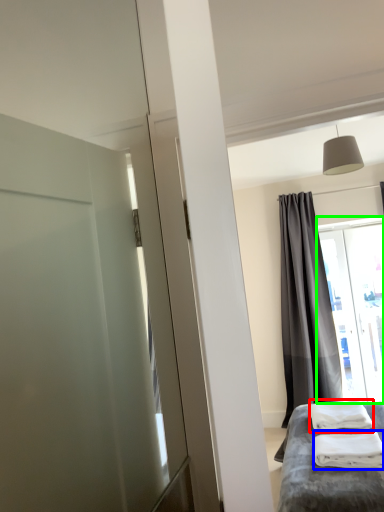
Question: Considering the real-world distances, which object is farthest from bath towel (highlighted by a red box)? material (highlighted by a blue box) or window (highlighted by a green box)?

Choices:
 (A) material
 (B) window

Answer: (B)